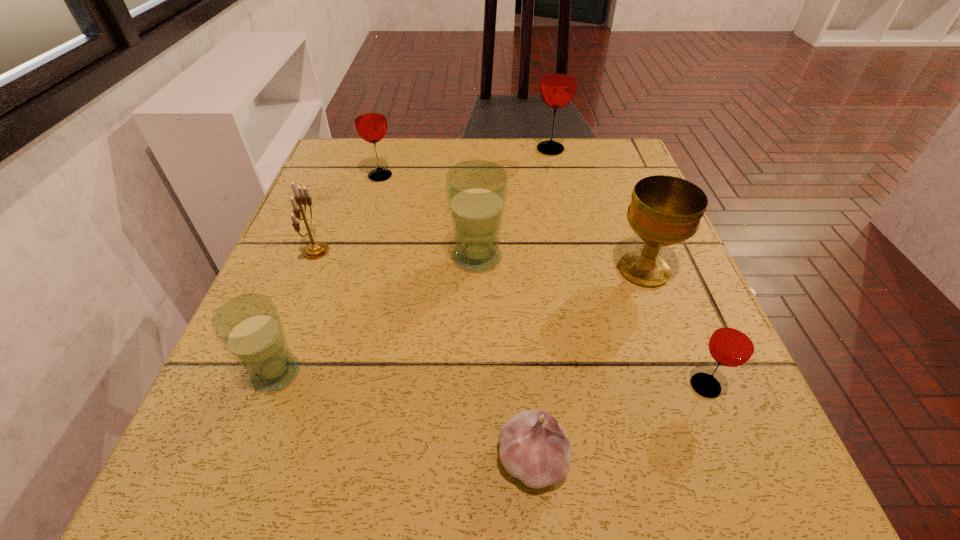
Locate an element on the screen. The image size is (960, 540). free spot at the right edge of the desktop is located at coordinates (671, 289).

Find the location of a particular element. The image size is (960, 540). free point at the far left corner is located at coordinates [359, 151].

Image resolution: width=960 pixels, height=540 pixels. What are the coordinates of `vacant space at the far right corner of the desktop` in the screenshot? It's located at (583, 143).

The width and height of the screenshot is (960, 540). In order to click on empty space between the gold candelabrum and the leftmost red glass in this screenshot , I will do `click(348, 213)`.

Image resolution: width=960 pixels, height=540 pixels. What are the coordinates of `free space between the smallest red glass and the chalice` in the screenshot? It's located at (675, 328).

The height and width of the screenshot is (540, 960). What are the coordinates of `free spot between the rightmost red glass and the fourth nearest glass` in the screenshot? It's located at (542, 281).

At what (x,y) coordinates should I click in order to perform the action: click on free spot between the garlic and the chalice. Please return your answer as a coordinate pair (x, y). This screenshot has width=960, height=540. Looking at the image, I should click on coord(588,364).

I want to click on vacant point located between the chalice and the nearest object, so click(588, 364).

The image size is (960, 540). Find the location of `empty space that is in between the smaller blue glass and the gold candelabrum`. empty space that is in between the smaller blue glass and the gold candelabrum is located at coordinates (296, 312).

Where is `unoccupied area between the second farthest red glass and the chalice`? unoccupied area between the second farthest red glass and the chalice is located at coordinates (512, 223).